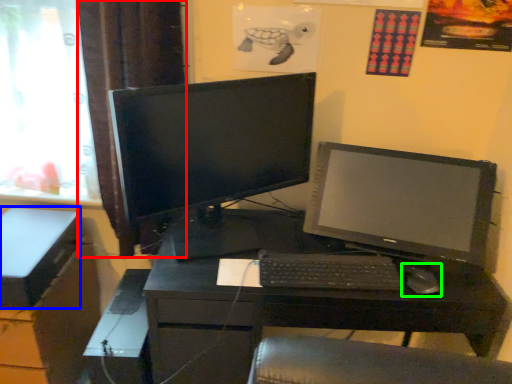
Question: Based on their relative distances, which object is nearer to curtain (highlighted by a red box)? Choose from box (highlighted by a blue box) and mouse (highlighted by a green box).

Choices:
 (A) box
 (B) mouse

Answer: (A)